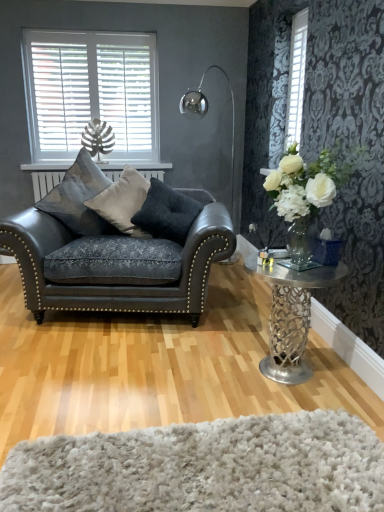
Locate an element on the screen. Image resolution: width=384 pixels, height=512 pixels. vacant region under metallic silver table at right (from a real-world perspective) is located at coordinates (286, 378).